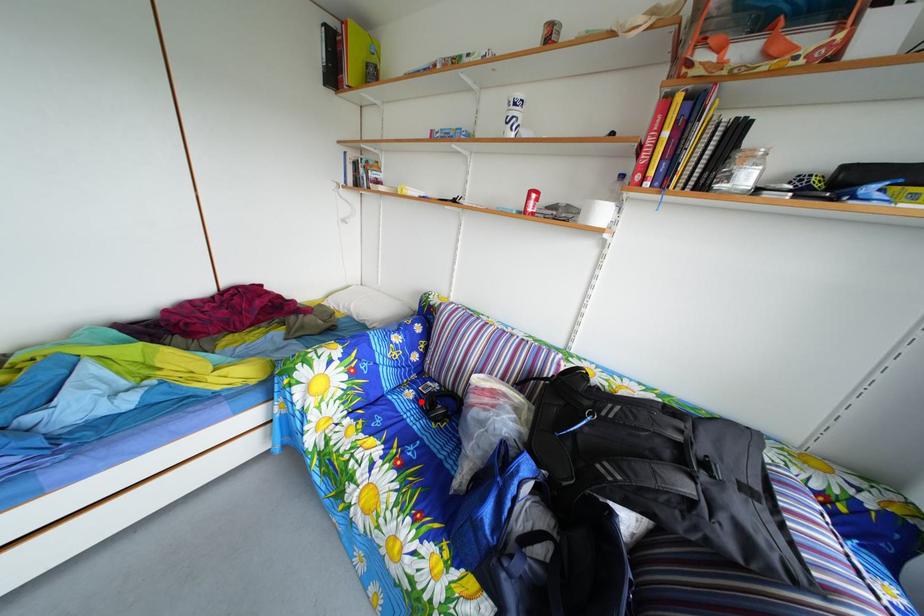
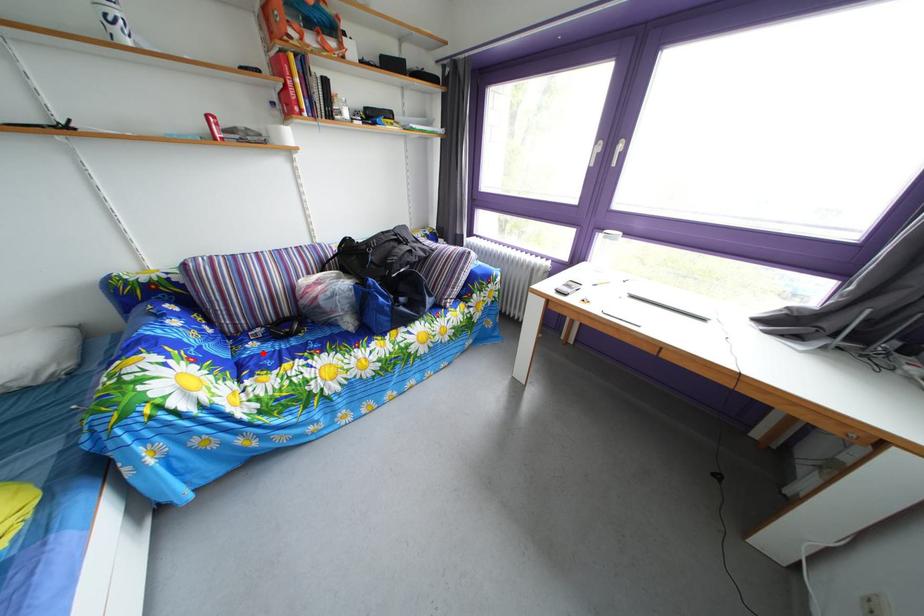
I am providing you with two images of the same scene from different viewpoints. A red point is marked on the first image and another point is marked on the second image. Does the point marked in image1 correspond to the same location as the one in image2?

Yes